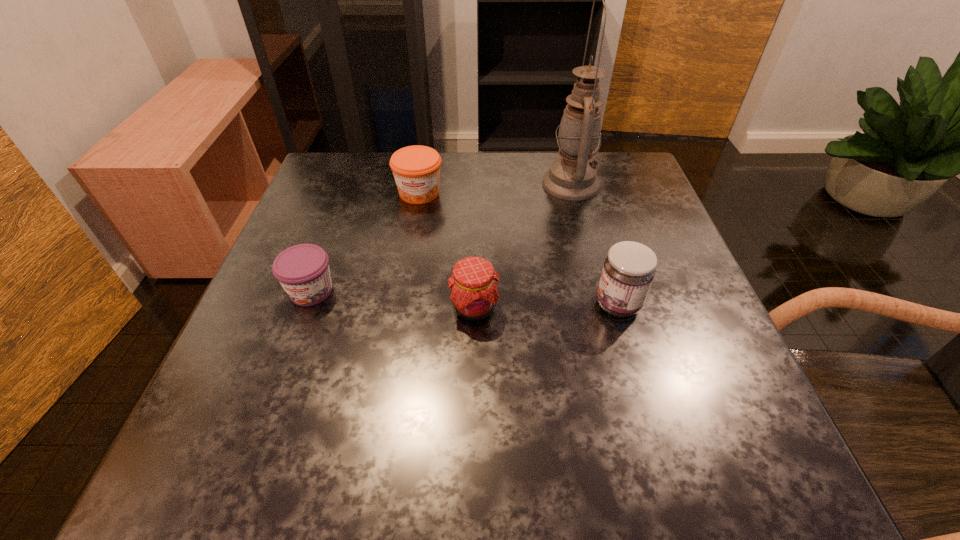
This screenshot has width=960, height=540. In order to click on oil lamp in this screenshot , I will do `click(572, 177)`.

Identify the location of the fourth shortest object. (628, 271).

Locate an element on the screen. the rightmost jam is located at coordinates (628, 271).

Locate an element on the screen. the second jam from left to right is located at coordinates (416, 169).

Locate an element on the screen. The image size is (960, 540). the farthest jam is located at coordinates (416, 169).

This screenshot has width=960, height=540. I want to click on the third jam from left to right, so click(474, 294).

In order to click on the shortest object in this screenshot , I will do `click(303, 271)`.

The width and height of the screenshot is (960, 540). I want to click on the leftmost jam, so click(x=303, y=271).

Identify the location of vacant point located on the front of the oil lamp. (594, 275).

Find the location of `free location located on the front label of the fourth shortest object`. free location located on the front label of the fourth shortest object is located at coordinates (441, 305).